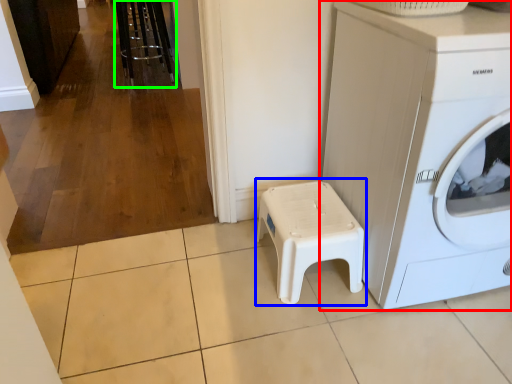
Question: Which object is the closest to the washing machine (highlighted by a red box)? Choose among these: music stool (highlighted by a blue box) or bar stool (highlighted by a green box).

Choices:
 (A) music stool
 (B) bar stool

Answer: (A)